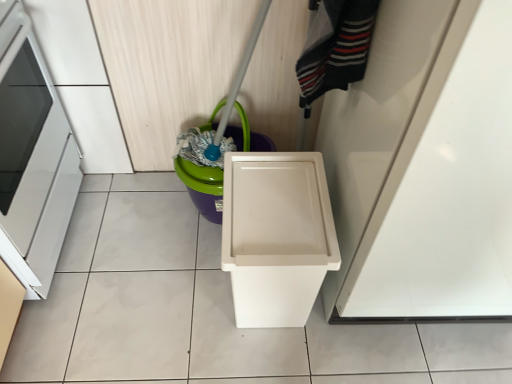
Question: Does white plastic waste container at center lie in front of matte green plastic bucket at center?

Choices:
 (A) no
 (B) yes

Answer: (B)

Question: Considering the relative sizes of white plastic waste container at center and matte green plastic bucket at center in the image provided, is white plastic waste container at center shorter than matte green plastic bucket at center?

Choices:
 (A) no
 (B) yes

Answer: (A)

Question: Is white plastic waste container at center with matte green plastic bucket at center?

Choices:
 (A) no
 (B) yes

Answer: (A)

Question: Considering the relative sizes of white plastic waste container at center and matte green plastic bucket at center in the image provided, is white plastic waste container at center smaller than matte green plastic bucket at center?

Choices:
 (A) no
 (B) yes

Answer: (A)

Question: Could you tell me if white plastic waste container at center is turned towards matte green plastic bucket at center?

Choices:
 (A) no
 (B) yes

Answer: (A)

Question: From their relative heights in the image, would you say white plastic waste container at center is taller or shorter than matte green plastic bucket at center?

Choices:
 (A) short
 (B) tall

Answer: (B)

Question: Which is correct: white plastic waste container at center is inside matte green plastic bucket at center, or outside of it?

Choices:
 (A) outside
 (B) inside

Answer: (A)

Question: Visually, is white plastic waste container at center positioned to the left or to the right of matte green plastic bucket at center?

Choices:
 (A) left
 (B) right

Answer: (B)

Question: In terms of width, does white plastic waste container at center look wider or thinner when compared to matte green plastic bucket at center?

Choices:
 (A) thin
 (B) wide

Answer: (B)

Question: Is point (327, 314) closer or farther from the camera than point (14, 122)?

Choices:
 (A) farther
 (B) closer

Answer: (B)

Question: In terms of width, does white glossy door at upper right look wider or thinner when compared to white glossy oven at left?

Choices:
 (A) wide
 (B) thin

Answer: (A)

Question: Is white glossy door at upper right taller or shorter than white glossy oven at left?

Choices:
 (A) short
 (B) tall

Answer: (B)

Question: Is white glossy door at upper right spatially inside white glossy oven at left, or outside of it?

Choices:
 (A) outside
 (B) inside

Answer: (A)

Question: Considering the positions of point (289, 279) and point (339, 16), is point (289, 279) closer or farther from the camera than point (339, 16)?

Choices:
 (A) closer
 (B) farther

Answer: (B)

Question: From the image's perspective, is white plastic waste container at center positioned above or below striped wool sweater at upper right?

Choices:
 (A) below
 (B) above

Answer: (A)